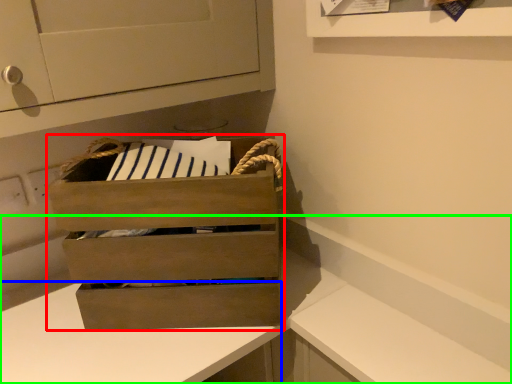
Question: Estimate the real-world distances between objects in this image. Which object is closer to chest of drawers (highlighted by a red box), counter (highlighted by a blue box) or counter (highlighted by a green box)?

Choices:
 (A) counter
 (B) counter

Answer: (A)